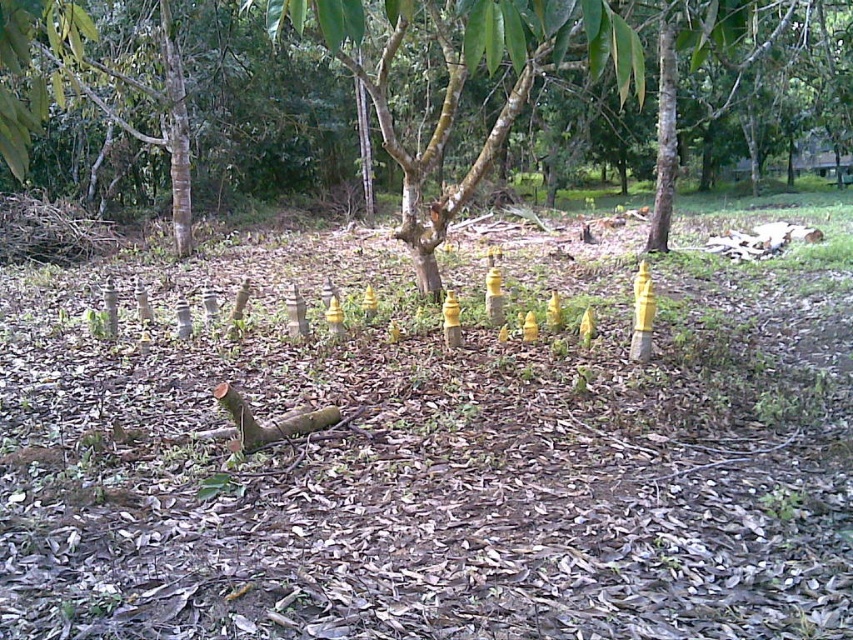
Who is positioned more to the left, brown rough log at center or yellow matte cone at center?

brown rough log at center is more to the left.

Is brown rough log at center bigger than yellow matte cone at center?

Correct, brown rough log at center is larger in size than yellow matte cone at center.

What do you see at coordinates (270, 420) in the screenshot?
I see `brown rough log at center` at bounding box center [270, 420].

What are the coordinates of `brown rough log at center` in the screenshot? It's located at (270, 420).

Is yellow matte tree at center taller than yellow matte cone at center?

Yes.

Can you confirm if yellow matte tree at center is thinner than yellow matte cone at center?

In fact, yellow matte tree at center might be wider than yellow matte cone at center.

Between point (376, 122) and point (532, 321), which one is positioned in front?

Point (532, 321) is in front.

Where is `yellow matte tree at center`? The image size is (853, 640). yellow matte tree at center is located at coordinates (465, 80).

Who is more forward, (672,20) or (316,417)?

Positioned in front is point (316,417).

Is point (798, 88) closer to camera compared to point (277, 433)?

No, it is not.

Does point (451, 28) lie behind point (317, 413)?

Yes, point (451, 28) is farther from viewer.

Where is `smooth bark tree at center`? smooth bark tree at center is located at coordinates (563, 83).